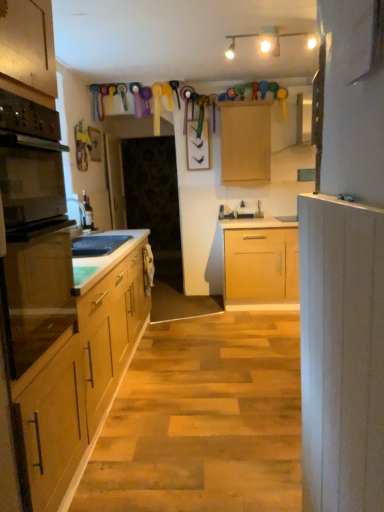
Question: From the image's perspective, is black glass oven at left below white painted wood cabinet at right, which appears as the 2th cabinetry when viewed from the top?

Choices:
 (A) no
 (B) yes

Answer: (A)

Question: Is white painted wood cabinet at right, which is counted as the 1th cabinetry, starting from the front, located within black glass oven at left?

Choices:
 (A) yes
 (B) no

Answer: (B)

Question: Is the depth of black glass oven at left less than that of white painted wood cabinet at right, placed as the first cabinetry when sorted from bottom to top?

Choices:
 (A) yes
 (B) no

Answer: (B)

Question: Is black glass oven at left far from white painted wood cabinet at right, which appears as the 2th cabinetry when viewed from the top?

Choices:
 (A) yes
 (B) no

Answer: (B)

Question: Does black glass oven at left turn towards white painted wood cabinet at right, placed as the first cabinetry when sorted from bottom to top?

Choices:
 (A) yes
 (B) no

Answer: (A)

Question: Can you confirm if black glass oven at left is taller than white painted wood cabinet at right, which is counted as the 1th cabinetry, starting from the front?

Choices:
 (A) yes
 (B) no

Answer: (B)

Question: Does white frosted glass light fixture at upper center have a greater width compared to black matte sink at left?

Choices:
 (A) yes
 (B) no

Answer: (A)

Question: Is white frosted glass light fixture at upper center further to the viewer compared to black matte sink at left?

Choices:
 (A) no
 (B) yes

Answer: (A)

Question: Is white frosted glass light fixture at upper center completely or partially outside of black matte sink at left?

Choices:
 (A) no
 (B) yes

Answer: (B)

Question: From the image's perspective, does white frosted glass light fixture at upper center appear higher than black matte sink at left?

Choices:
 (A) yes
 (B) no

Answer: (A)

Question: Is white frosted glass light fixture at upper center far from black matte sink at left?

Choices:
 (A) no
 (B) yes

Answer: (B)

Question: Does white frosted glass light fixture at upper center have a larger size compared to black matte sink at left?

Choices:
 (A) no
 (B) yes

Answer: (B)

Question: Is the position of white painted wood cabinet at right, placed as the first cabinetry when sorted from bottom to top, less distant than that of white frosted glass light fixture at upper center?

Choices:
 (A) no
 (B) yes

Answer: (B)